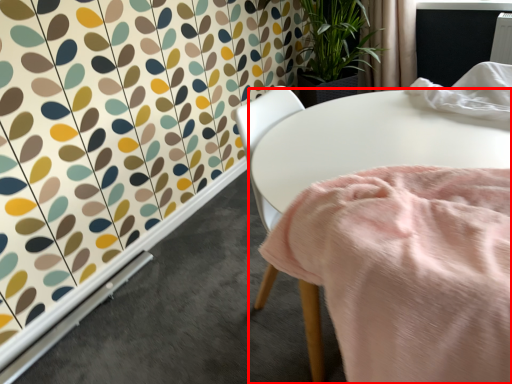
Question: In this image, where is table (annotated by the red box) located relative to curtain?

Choices:
 (A) right
 (B) left

Answer: (B)